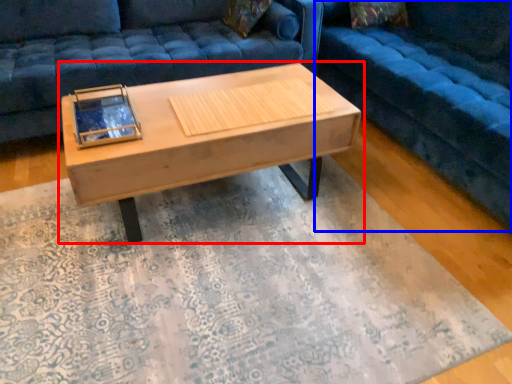
Question: Among these objects, which one is nearest to the camera, coffee table (highlighted by a red box) or studio couch (highlighted by a blue box)?

Choices:
 (A) coffee table
 (B) studio couch

Answer: (B)